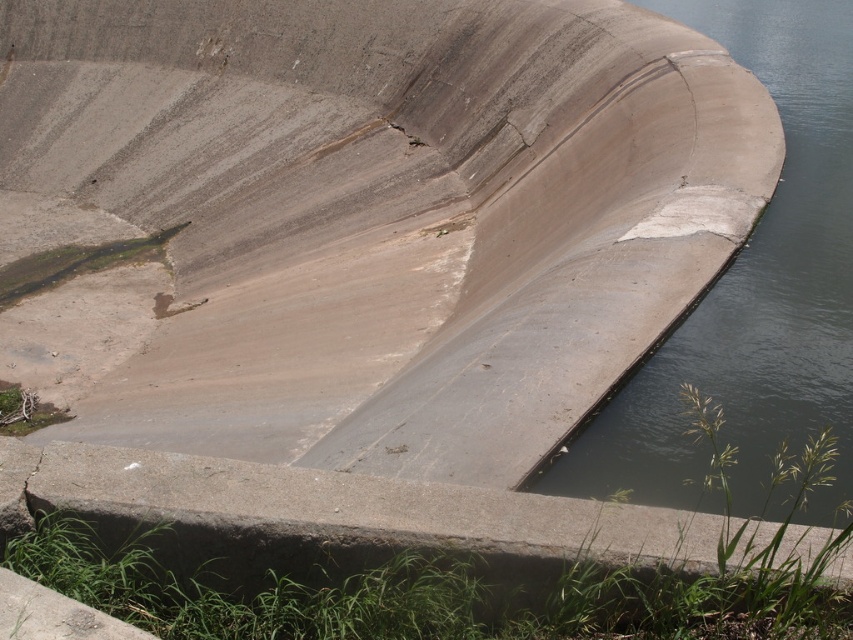
Question: Which point is closer to the camera taking this photo?

Choices:
 (A) click(639, 544)
 (B) click(497, 138)
 (C) click(813, 348)

Answer: (A)

Question: Which of the following is the closest to the observer?

Choices:
 (A) (834, 577)
 (B) (660, 433)

Answer: (A)

Question: Does gray concrete dam at center lie behind gray concrete at bottom?

Choices:
 (A) no
 (B) yes

Answer: (B)

Question: Does gray concrete dam at center appear under gray concrete at bottom?

Choices:
 (A) yes
 (B) no

Answer: (B)

Question: Is gray concrete dam at center positioned at the back of gray concrete waterway at center-right?

Choices:
 (A) no
 (B) yes

Answer: (A)

Question: Which of the following is the farthest from the observer?

Choices:
 (A) gray concrete dam at center
 (B) gray concrete waterway at center-right

Answer: (B)